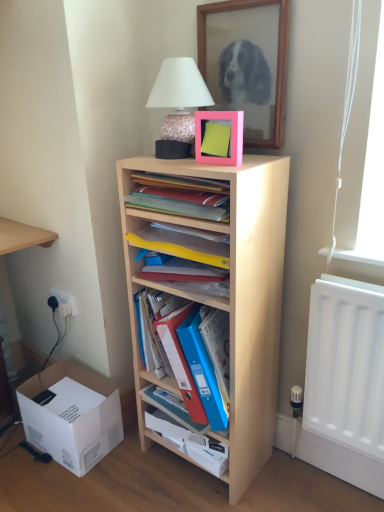
Question: From the image's perspective, is blue plastic folders at center above or below white plastic electric outlet at lower left, the first electric outlet viewed from the right?

Choices:
 (A) below
 (B) above

Answer: (A)

Question: Looking at the image, does blue plastic folders at center seem bigger or smaller compared to white plastic electric outlet at lower left, arranged as the second electric outlet when viewed from the left?

Choices:
 (A) small
 (B) big

Answer: (B)

Question: Based on their relative distances, which object is nearer to the white plastic electric outlet at lower left, the first electric outlet in the left-to-right sequence?

Choices:
 (A) light wood shelf at center, acting as the 3th shelf starting from the top
 (B) yellow paper at center, which is counted as the 3th shelf, starting from the bottom
 (C) light wood shelves at center, the fourth shelf ordered from the bottom
 (D) wooden framed mirror at upper center
 (E) blue plastic folders at center

Answer: (E)

Question: Which of these objects is positioned closest to the blue plastic folders at center, which is the 4th shelf from top to bottom?

Choices:
 (A) pink matte picture frame at upper center
 (B) blue plastic folders at center
 (C) white plastic electric outlet at lower left, arranged as the 2th electric outlet when viewed from the right
 (D) light wood shelf at center, the second shelf in the bottom-to-top sequence
 (E) yellow paper at center, which is counted as the 3th shelf, starting from the bottom

Answer: (E)